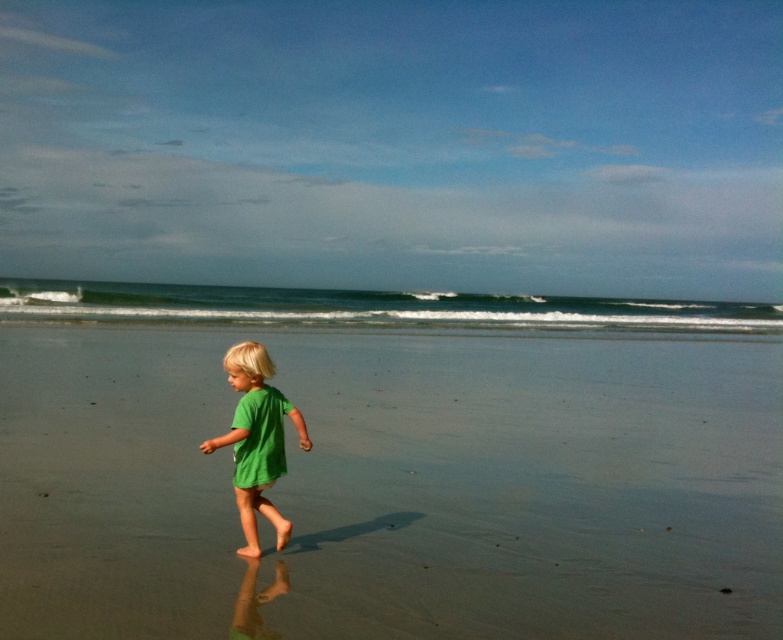
The height and width of the screenshot is (640, 783). What do you see at coordinates (394, 486) in the screenshot?
I see `smooth sand at center` at bounding box center [394, 486].

Does point (168, 390) come behind point (367, 298)?

No.

Where is `smooth sand at center`? The width and height of the screenshot is (783, 640). smooth sand at center is located at coordinates (394, 486).

At what (x,y) coordinates should I click in order to perform the action: click on smooth sand at center. Please return your answer as a coordinate pair (x, y). The width and height of the screenshot is (783, 640). Looking at the image, I should click on (394, 486).

Is blue-green water at center bigger than green matte shirt at center?

Correct, blue-green water at center is larger in size than green matte shirt at center.

The width and height of the screenshot is (783, 640). What do you see at coordinates (370, 307) in the screenshot?
I see `blue-green water at center` at bounding box center [370, 307].

Image resolution: width=783 pixels, height=640 pixels. I want to click on blue-green water at center, so point(370,307).

Is point (186, 436) farther from camera compared to point (269, 408)?

Yes, it is behind point (269, 408).

Does smooth sand at center appear over green matte shirt at center?

Correct, smooth sand at center is located above green matte shirt at center.

Is point (500, 609) more distant than point (246, 429)?

No.

Locate an element on the screen. The height and width of the screenshot is (640, 783). smooth sand at center is located at coordinates (394, 486).